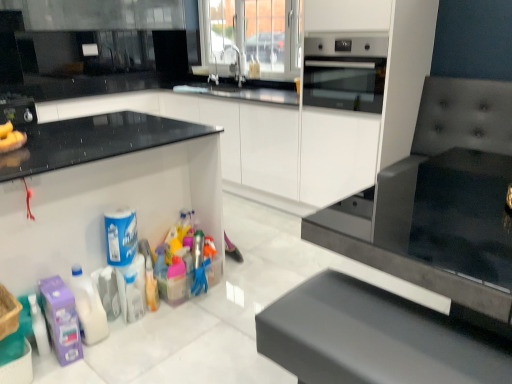
Question: Considering the positions of brushed metal toaster at left and translucent plastic bottle at lower left in the image, is brushed metal toaster at left wider or thinner than translucent plastic bottle at lower left?

Choices:
 (A) wide
 (B) thin

Answer: (A)

Question: Is brushed metal toaster at left in front of or behind translucent plastic bottle at lower left in the image?

Choices:
 (A) behind
 (B) front

Answer: (A)

Question: Based on their relative distances, which object is farther from the blue plastic canister at lower left, which is the 3th cleaning product from left to right?

Choices:
 (A) stainless steel oven at upper right
 (B) white glossy cabinet at center, which is the 2th cabinetry in front-to-back order
 (C) silver metallic faucet at upper center, which is the 2th faucet from right to left
 (D) purple matte cleaning product at lower left, which is the 4th cleaning product from right to left
 (E) brushed metal toaster at left

Answer: (C)

Question: Estimate the real-world distances between objects in this image. Which object is closer to the white glossy cabinet at center, which is the 2th cabinetry in front-to-back order?

Choices:
 (A) silver metallic faucet at upper center, which is the 2th faucet from left to right
 (B) translucent plastic bottle at lower left
 (C) purple matte cleaning product at lower left, which is the 4th cleaning product from right to left
 (D) blue plastic canister at lower left, which appears as the second cleaning product when viewed from the right
 (E) silver metallic faucet at upper center, the first faucet in the left-to-right sequence

Answer: (A)